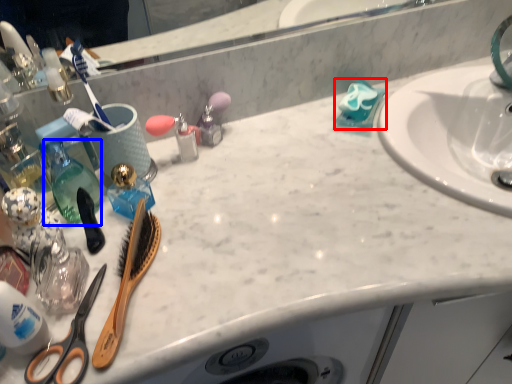
Question: Which of the following is the farthest to the observer, cleaning product (highlighted by a red box) or bottle (highlighted by a blue box)?

Choices:
 (A) cleaning product
 (B) bottle

Answer: (A)